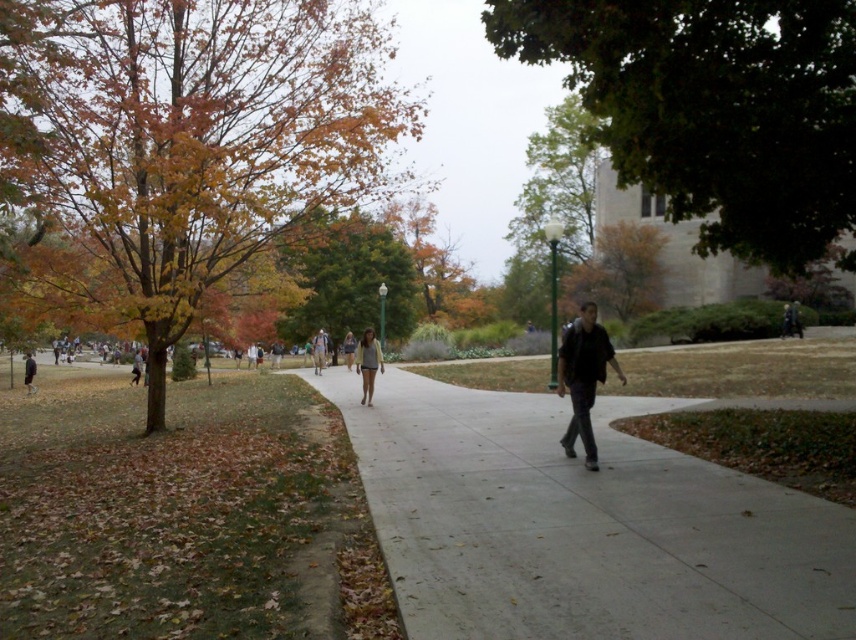
You are a photographer standing at the end of the paved pathway in the autumn scene. You notice two people wearing the light beige sweater at center and the light brown leather jacket at center. Which clothing item takes up more visual space in the photo?

The light beige sweater at center takes up more visual space in the photo because it is larger in size than the light brown leather jacket at center.